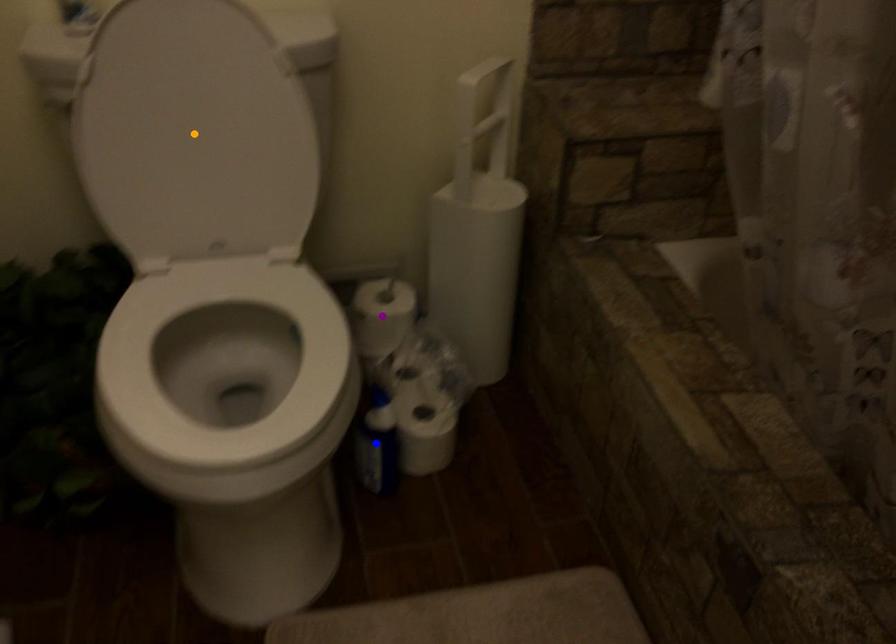
Order these from nearest to farthest:
- blue point
- purple point
- orange point

orange point
blue point
purple point